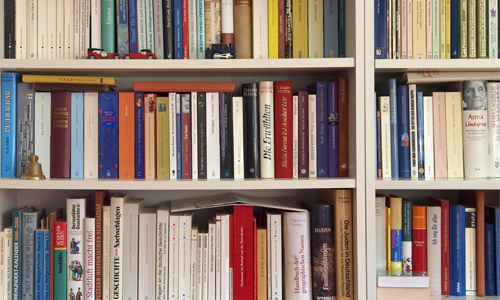
The height and width of the screenshot is (300, 500). What are the coordinates of `red books` in the screenshot? It's located at (237, 261), (232, 242), (420, 252), (285, 146), (184, 36), (185, 148), (169, 87).